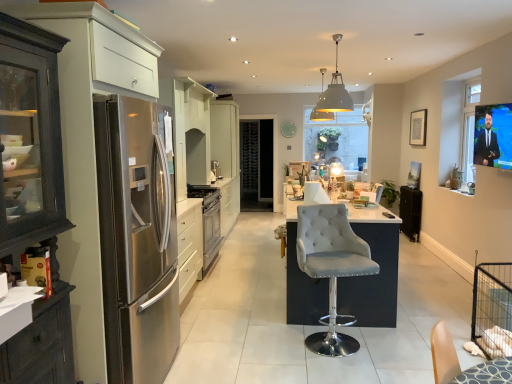
Question: Is suede-like gray bar stool at center inside or outside of white glossy cabinet at center?

Choices:
 (A) outside
 (B) inside

Answer: (A)

Question: From a real-world perspective, is suede-like gray bar stool at center physically located above or below white glossy cabinet at center?

Choices:
 (A) below
 (B) above

Answer: (A)

Question: Estimate the real-world distances between objects in this image. Which object is farther from the suede-like gray bar stool at center?

Choices:
 (A) white glossy cabinet at center
 (B) stainless steel oven at center
 (C) black matte radiator at right, which appears as the 2th appliance when viewed from the top
 (D) satin silver oven at center, positioned as the 1th appliance in left-to-right order
 (E) satin silver refrigerator at left

Answer: (A)

Question: Which of these objects is positioned closest to the stainless steel oven at center?

Choices:
 (A) satin silver refrigerator at left
 (B) matte gray pendant light at center
 (C) black glass wine cellar at center
 (D) white glossy cabinet at center
 (E) satin silver oven at center, positioned as the 1th appliance in left-to-right order

Answer: (E)